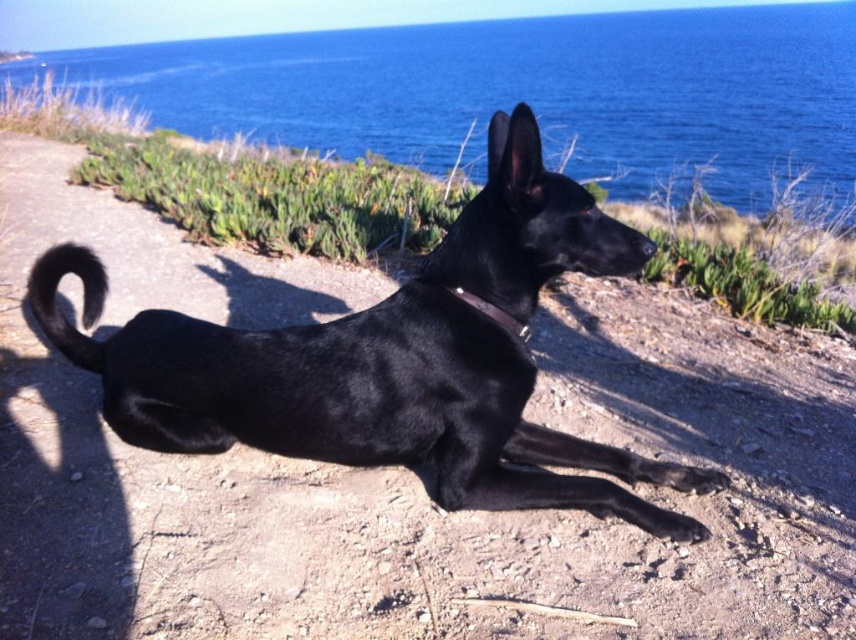
Question: Is black smooth dog at center in front of blue water at upper center?

Choices:
 (A) no
 (B) yes

Answer: (B)

Question: Where is black smooth dog at center located in relation to blue water at upper center in the image?

Choices:
 (A) above
 (B) below

Answer: (B)

Question: Is blue water at upper center closer to the viewer compared to metallic silver neckband at center?

Choices:
 (A) yes
 (B) no

Answer: (B)

Question: Which object appears closest to the camera in this image?

Choices:
 (A) metallic silver neckband at center
 (B) blue water at upper center

Answer: (A)

Question: Based on their relative distances, which object is nearer to the blue water at upper center?

Choices:
 (A) black smooth dog at center
 (B) metallic silver neckband at center

Answer: (A)

Question: Which of the following is the closest to the observer?

Choices:
 (A) (519, 440)
 (B) (470, 294)

Answer: (B)